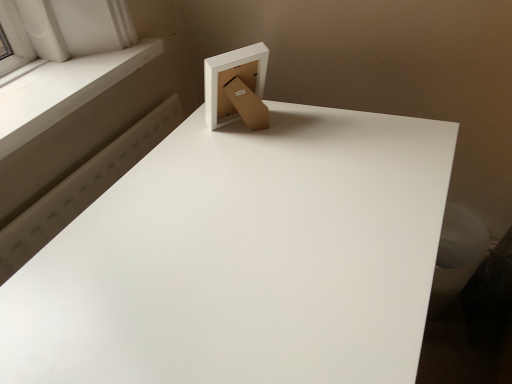
Question: Visually, is white smooth window sill at upper left positioned to the left or to the right of matte cardboard box at upper center?

Choices:
 (A) right
 (B) left

Answer: (B)

Question: Is white smooth window sill at upper left spatially inside matte cardboard box at upper center, or outside of it?

Choices:
 (A) inside
 (B) outside

Answer: (B)

Question: Estimate the real-world distances between objects in this image. Which object is closer to the matte cardboard box at upper center?

Choices:
 (A) white smooth window sill at upper left
 (B) white matte table at upper center

Answer: (B)

Question: Estimate the real-world distances between objects in this image. Which object is closer to the white smooth window sill at upper left?

Choices:
 (A) matte cardboard box at upper center
 (B) white matte table at upper center

Answer: (A)